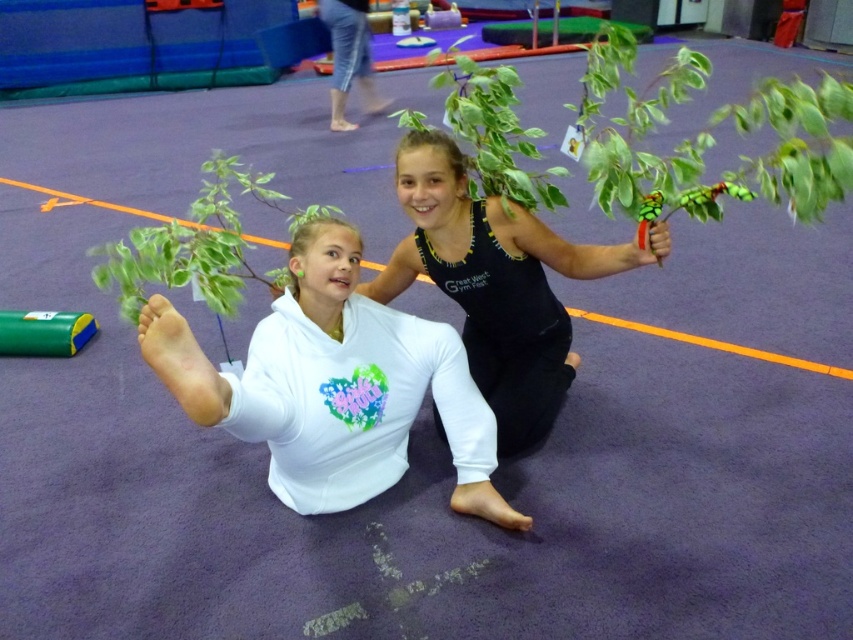
Question: Is black matte tank top at center wider than green glossy plant at center?

Choices:
 (A) no
 (B) yes

Answer: (B)

Question: Which object is farther from the camera taking this photo?

Choices:
 (A) green glossy plant at center
 (B) green leafy plant at center
 (C) black matte tank top at center
 (D) white matte hoodie at center

Answer: (A)

Question: Observing the image, what is the correct spatial positioning of white matte hoodie at center in reference to green glossy plant at center?

Choices:
 (A) right
 (B) left

Answer: (B)

Question: Can you confirm if white matte hoodie at center is positioned below green glossy plant at center?

Choices:
 (A) no
 (B) yes

Answer: (B)

Question: Estimate the real-world distances between objects in this image. Which object is farther from the green leafy plant at center?

Choices:
 (A) white matte hoodie at center
 (B) black matte tank top at center
 (C) green glossy plant at center

Answer: (C)

Question: Which object is positioned closest to the white matte hoodie at center?

Choices:
 (A) green leafy plant at center
 (B) green glossy plant at center

Answer: (A)